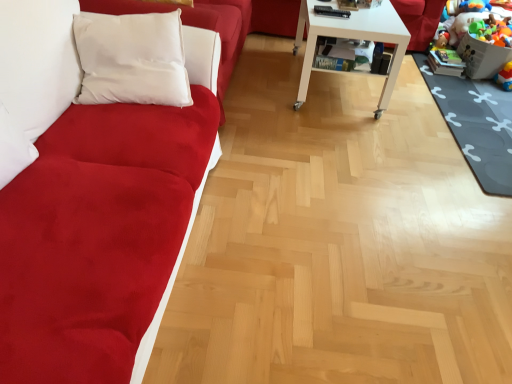
Image resolution: width=512 pixels, height=384 pixels. Find the location of `free space in front of white glossy table at center`. free space in front of white glossy table at center is located at coordinates (341, 137).